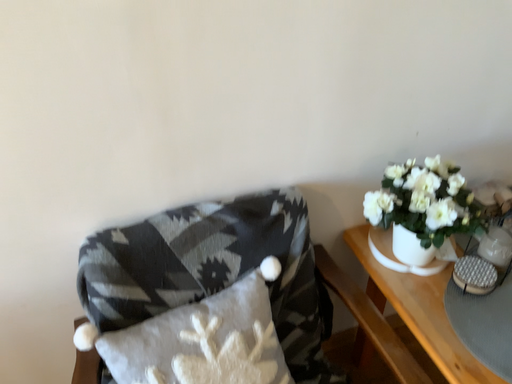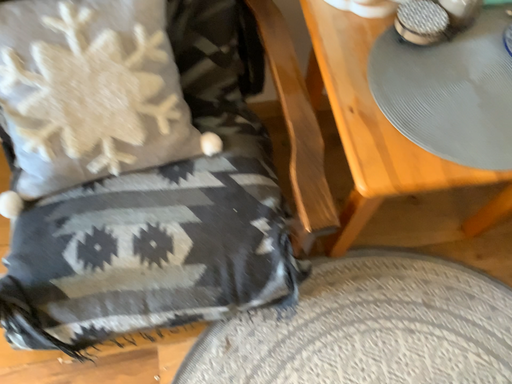
Question: How did the camera likely rotate when shooting the video?

Choices:
 (A) rotated upward
 (B) rotated downward

Answer: (B)